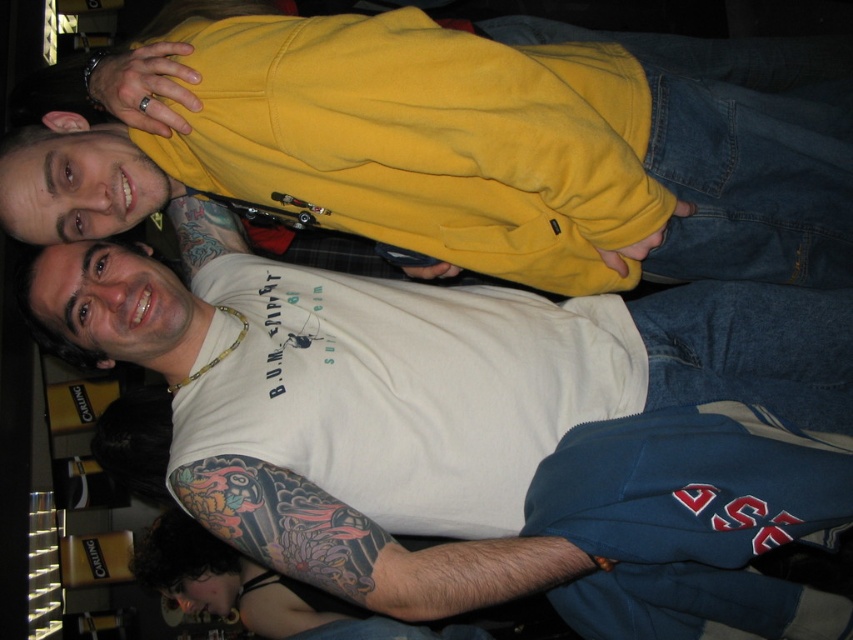
Based on the scene description, can you determine the spatial relationship between the yellow matte sweatshirt at upper center and the colored tattooed arm at lower left?

The yellow matte sweatshirt at upper center is to the right of the colored tattooed arm at lower left.